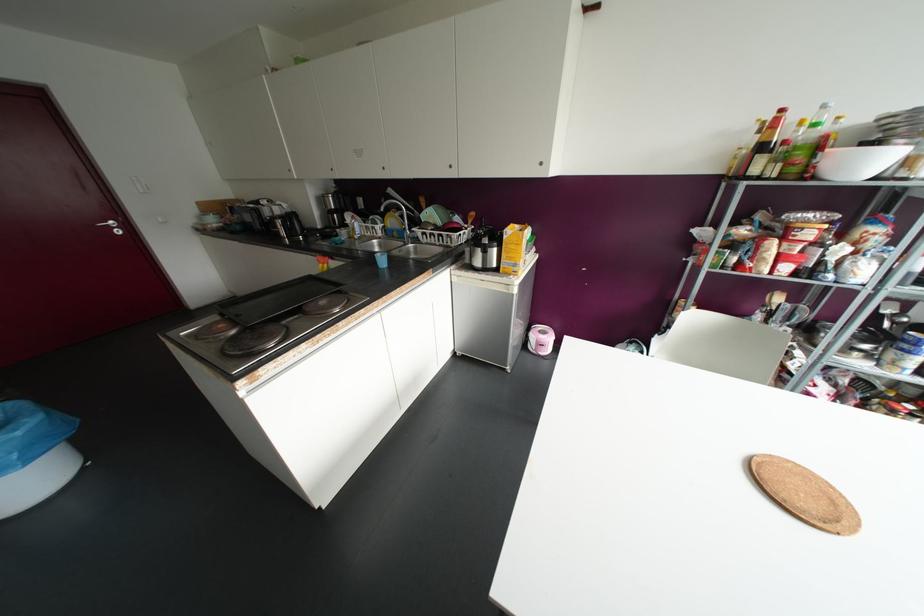
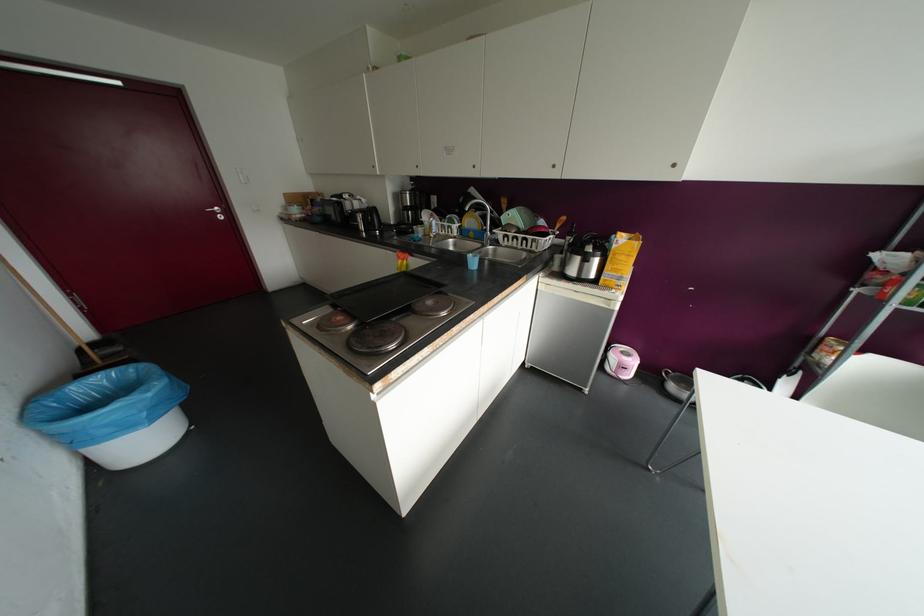
Where in the second image is the point corresponding to point 450,166 from the first image?

(553, 166)